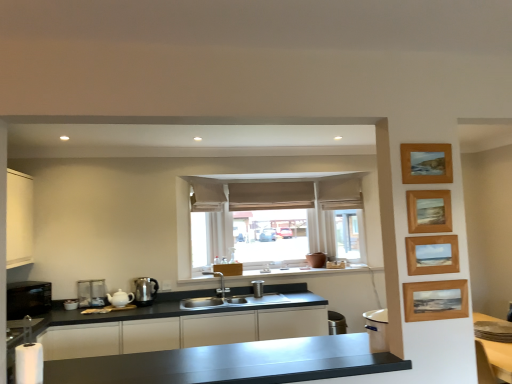
Question: From a real-world perspective, is satin black countertop at center, arranged as the 1th cabinetry when viewed from the right, above or below satin silver kettle at lower left, the second appliance in the right-to-left sequence?

Choices:
 (A) above
 (B) below

Answer: (B)

Question: Is satin black countertop at center, arranged as the 1th cabinetry when viewed from the right, to the left or to the right of satin silver kettle at lower left, the 2th appliance when ordered from front to back, in the image?

Choices:
 (A) right
 (B) left

Answer: (A)

Question: Estimate the real-world distances between objects in this image. Which object is closer to the satin black countertop at lower left?

Choices:
 (A) beige fabric curtain at upper center, which is counted as the 3th curtain, starting from the left
 (B) satin silver kettle at lower left, the second appliance when ordered from left to right
 (C) wooden picture frame at right, which ranks as the fourth picture frame in top-to-bottom order
 (D) satin black countertop at center, placed as the 2th cabinetry when sorted from left to right
 (E) white fabric curtain at upper center, positioned as the 1th curtain in left-to-right order

Answer: (C)

Question: Estimate the real-world distances between objects in this image. Which object is closer to the wooden picture frame at upper right, the 1th picture frame from the top?

Choices:
 (A) satin black countertop at lower left
 (B) satin black countertop at center, placed as the 2th cabinetry when sorted from left to right
 (C) wooden picture frame at upper right, which is the second picture frame in top-to-bottom order
 (D) white fabric curtain at upper center, positioned as the 1th curtain in left-to-right order
 (E) satin silver kettle at lower left, the 2th appliance viewed from the back

Answer: (C)